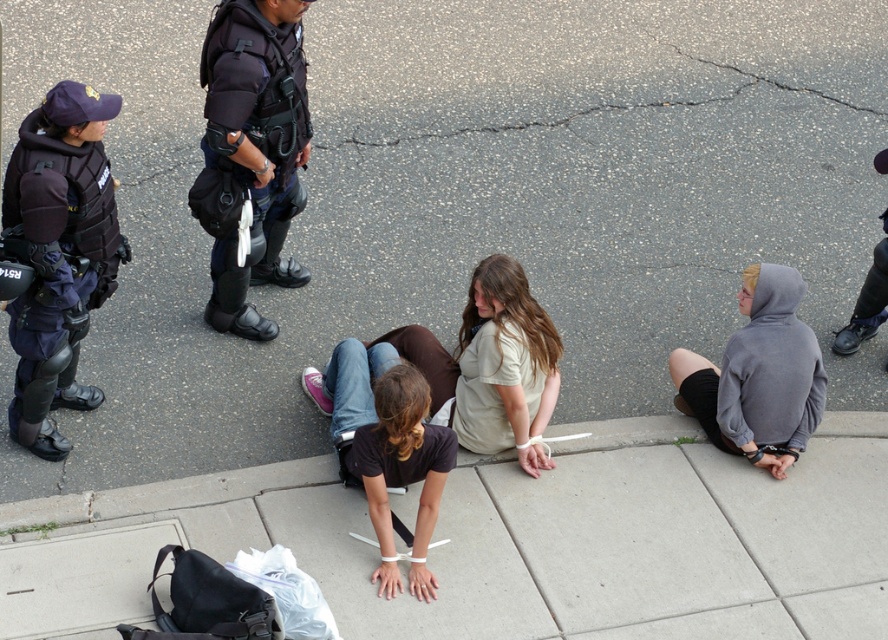
Which of these two, dark brown shirt at center or concrete at lower center, stands taller?

dark brown shirt at center is taller.

Between dark brown shirt at center and concrete at lower center, which one has less height?

With less height is concrete at lower center.

This screenshot has width=888, height=640. What are the coordinates of `dark brown shirt at center` in the screenshot? It's located at (385, 445).

In order to click on dark brown shirt at center in this screenshot , I will do `click(385, 445)`.

Between point (52, 227) and point (482, 317), which one is positioned behind?

Point (482, 317)

Is dark blue tactical vest at left shorter than light brown cotton shirt at center?

No.

Who is more forward, (73,232) or (538,413)?

Point (73,232) is more forward.

The width and height of the screenshot is (888, 640). Identify the location of dark blue tactical vest at left. (58, 253).

Is gray hoodie at lower right closer to the viewer compared to concrete at lower center?

No, it is not.

Who is taller, gray hoodie at lower right or concrete at lower center?

gray hoodie at lower right

Where is `gray hoodie at lower right`? The image size is (888, 640). gray hoodie at lower right is located at coordinates (759, 376).